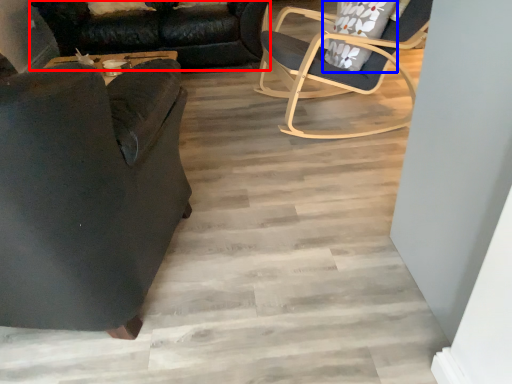
Question: Which object is further to the camera taking this photo, studio couch (highlighted by a red box) or pillow (highlighted by a blue box)?

Choices:
 (A) studio couch
 (B) pillow

Answer: (A)